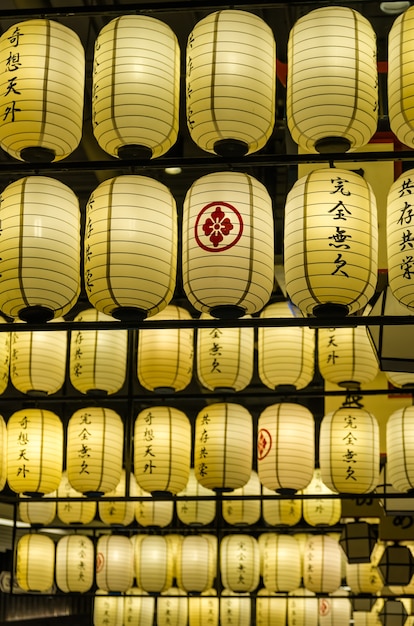
Find the location of `white dark ceiling`. white dark ceiling is located at coordinates (78, 24).